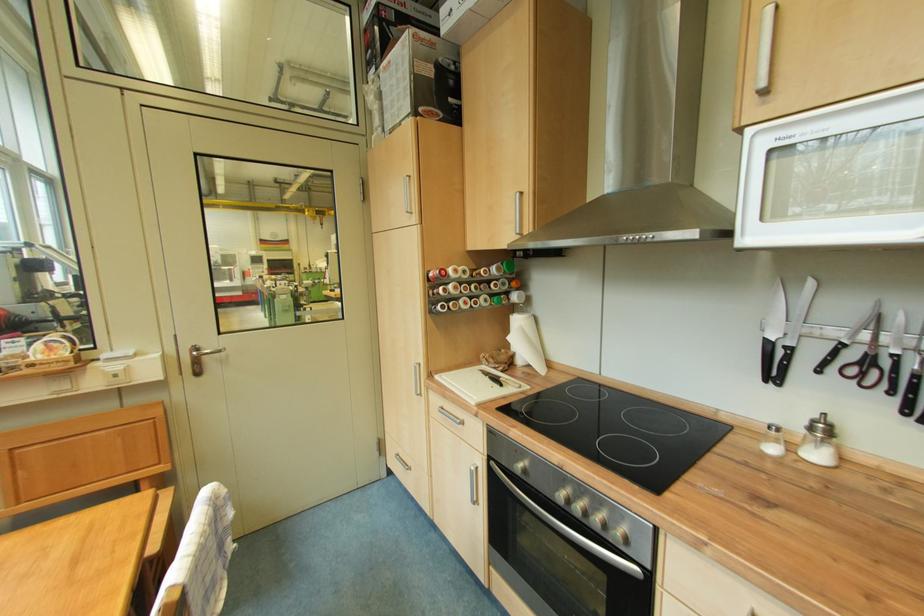
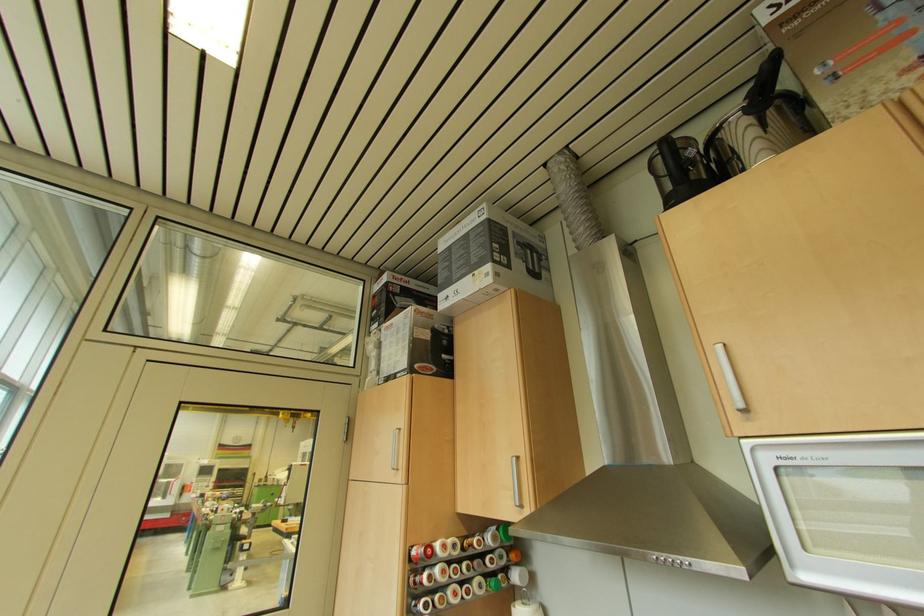
The point at (478, 251) is marked in the first image. Where is the corresponding point in the second image?

(468, 513)